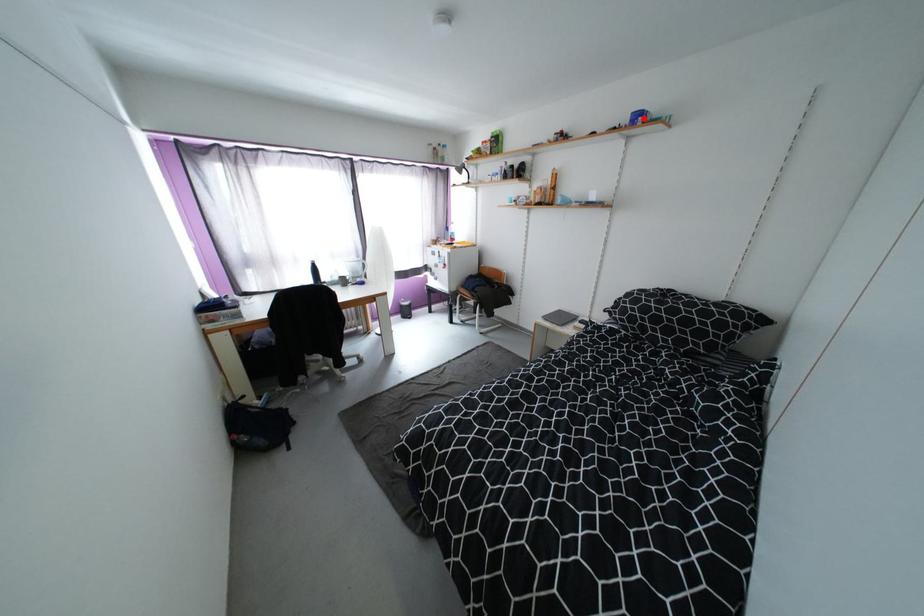
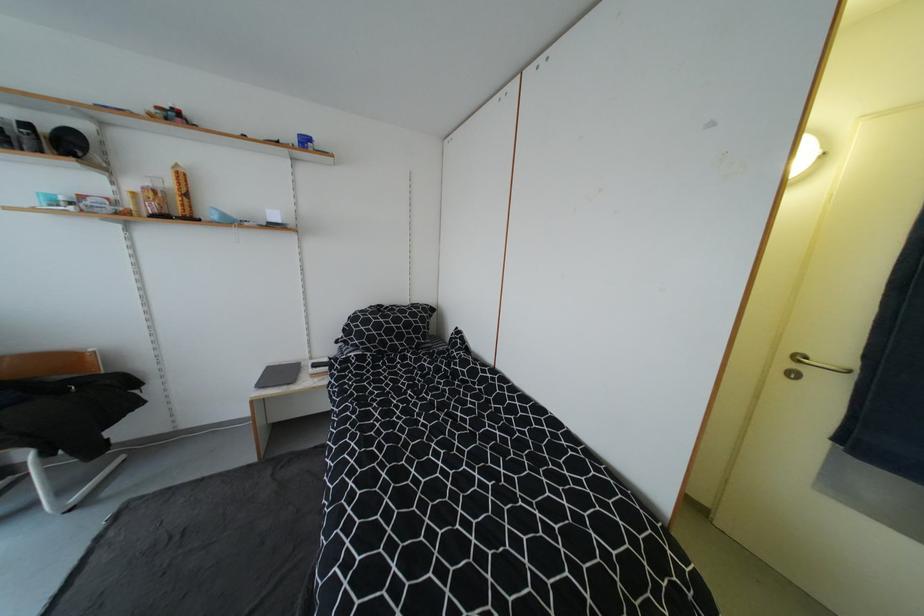
Locate, in the second image, the point that corresponds to the highlighted location in the first image.

(311, 143)